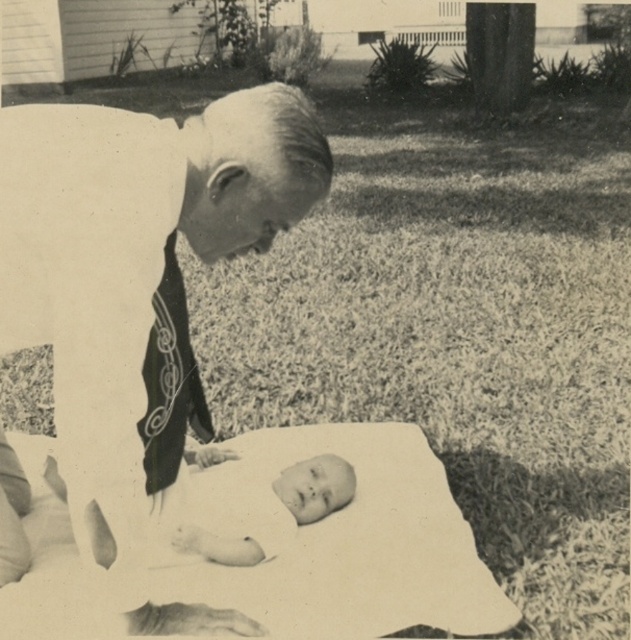
Question: Where is white cloth at upper left located in relation to smooth white baby at center in the image?

Choices:
 (A) below
 (B) above

Answer: (B)

Question: Which object is farther from the camera taking this photo?

Choices:
 (A) white cloth at upper left
 (B) smooth white baby at center

Answer: (B)

Question: Does white cloth at upper left have a lesser width compared to smooth white baby at center?

Choices:
 (A) no
 (B) yes

Answer: (A)

Question: Which object is closer to the camera taking this photo?

Choices:
 (A) white cloth at upper left
 (B) smooth white baby at center

Answer: (A)

Question: From the image, what is the correct spatial relationship of white cloth at upper left in relation to smooth white baby at center?

Choices:
 (A) above
 (B) below

Answer: (A)